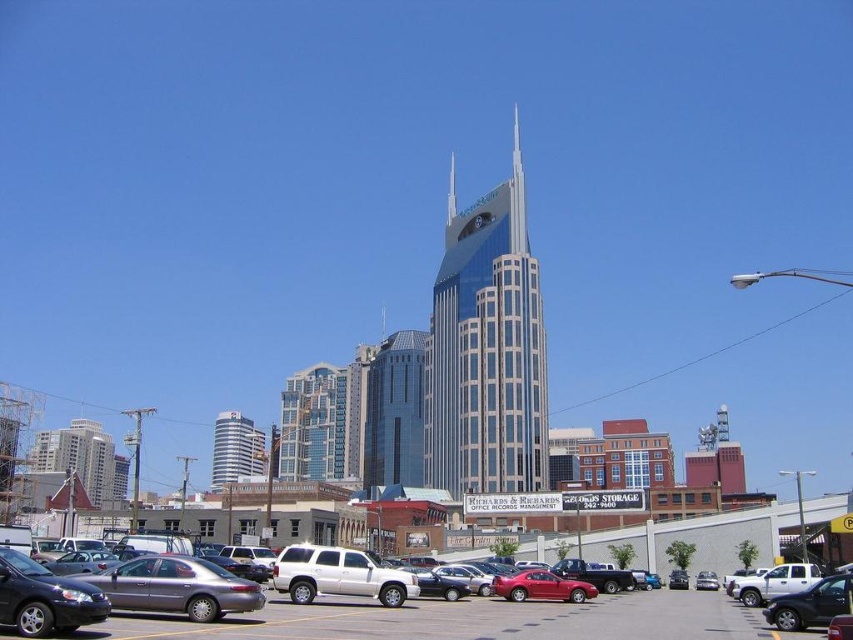
Does white glossy building at center appear under metallic silver sedan at center?

Yes, white glossy building at center is below metallic silver sedan at center.

Between white glossy building at center and metallic silver sedan at center, which one is positioned higher?

Positioned higher is metallic silver sedan at center.

You are a GUI agent. You are given a task and a screenshot of the screen. Output one action in this format:
    pyautogui.click(x=<x>, y=<y>)
    Task: Click on the white glossy building at center
    The image size is (853, 640).
    Given the screenshot: What is the action you would take?
    pyautogui.click(x=236, y=449)

Identify the location of glass skyscraper at center. (486, 348).

Looking at this image, between glassy steel skyscraper at center and metallic gray sedan at lower left, which one appears on the left side from the viewer's perspective?

Positioned to the left is metallic gray sedan at lower left.

Which is behind, point (405, 452) or point (103, 573)?

The point (405, 452) is more distant.

Image resolution: width=853 pixels, height=640 pixels. What are the coordinates of `glassy steel skyscraper at center` in the screenshot? It's located at (396, 412).